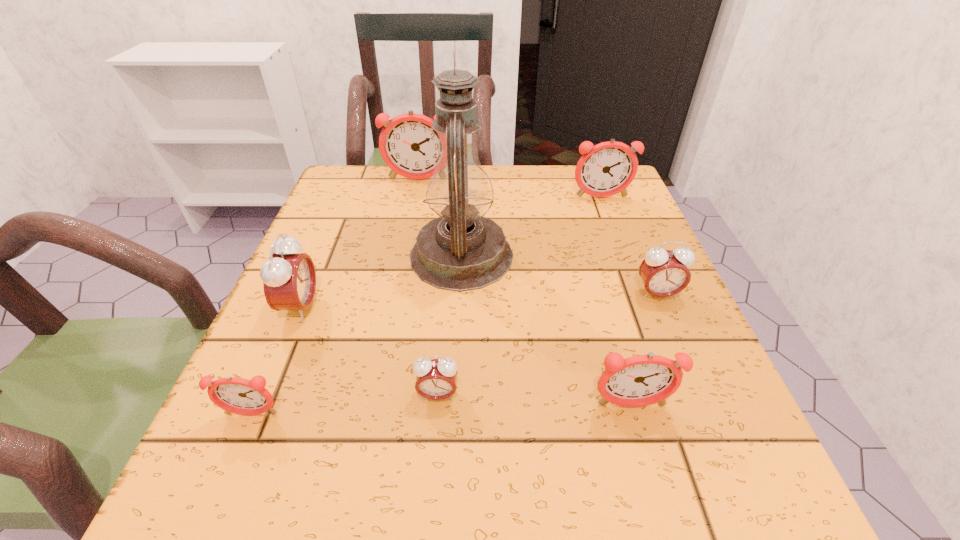
At what (x,y) coordinates should I click in order to perform the action: click on the smallest reddish-pink alarm clock. Please return your answer as a coordinate pair (x, y). Looking at the image, I should click on (235, 395).

You are a GUI agent. You are given a task and a screenshot of the screen. Output one action in this format:
    pyautogui.click(x=<x>, y=<y>)
    Task: Click on the vacant space situated on the left of the tallest object
    This screenshot has width=960, height=540.
    Given the screenshot: What is the action you would take?
    (x=307, y=256)

At what (x,y) coordinates should I click in order to perform the action: click on vacant space positioned 0.260m on the front-facing side of the farthest alarm clock. Please return your answer as a coordinate pair (x, y). This screenshot has width=960, height=540. Looking at the image, I should click on (404, 247).

At what (x,y) coordinates should I click in order to perform the action: click on free space located on the front-facing side of the second farthest alarm clock. Please return your answer as a coordinate pair (x, y). The height and width of the screenshot is (540, 960). Looking at the image, I should click on (610, 221).

In order to click on free spot located on the clock face of the leftmost pink alarm clock in this screenshot , I will do pyautogui.click(x=532, y=307).

At what (x,y) coordinates should I click in order to perform the action: click on vacant area situated 0.090m on the clock face of the second biggest pink alarm clock. Please return your answer as a coordinate pair (x, y). Looking at the image, I should click on (677, 341).

Where is `free location located 0.100m on the front-facing side of the third biggest reddish-pink alarm clock`? This screenshot has height=540, width=960. free location located 0.100m on the front-facing side of the third biggest reddish-pink alarm clock is located at coordinates (654, 484).

Where is `free space located on the clock face of the nearest pink alarm clock`? Image resolution: width=960 pixels, height=540 pixels. free space located on the clock face of the nearest pink alarm clock is located at coordinates pyautogui.click(x=432, y=472).

Image resolution: width=960 pixels, height=540 pixels. Find the location of `free spot located on the front-facing side of the leftmost reddish-pink alarm clock`. free spot located on the front-facing side of the leftmost reddish-pink alarm clock is located at coordinates (218, 493).

What are the coordinates of `object present at the far left corner` in the screenshot? It's located at (409, 146).